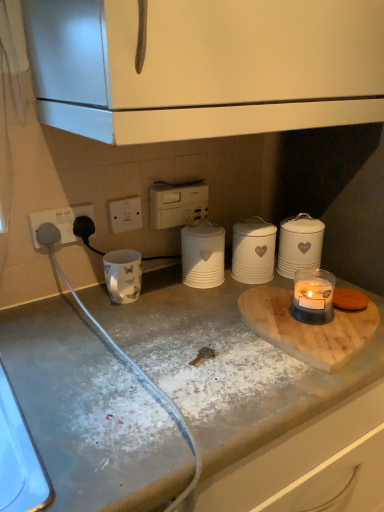
Where is `vacant space that is to the left of white matte canister at center, which ranks as the 1th kitchen appliance in left-to-right order`? vacant space that is to the left of white matte canister at center, which ranks as the 1th kitchen appliance in left-to-right order is located at coordinates (185, 293).